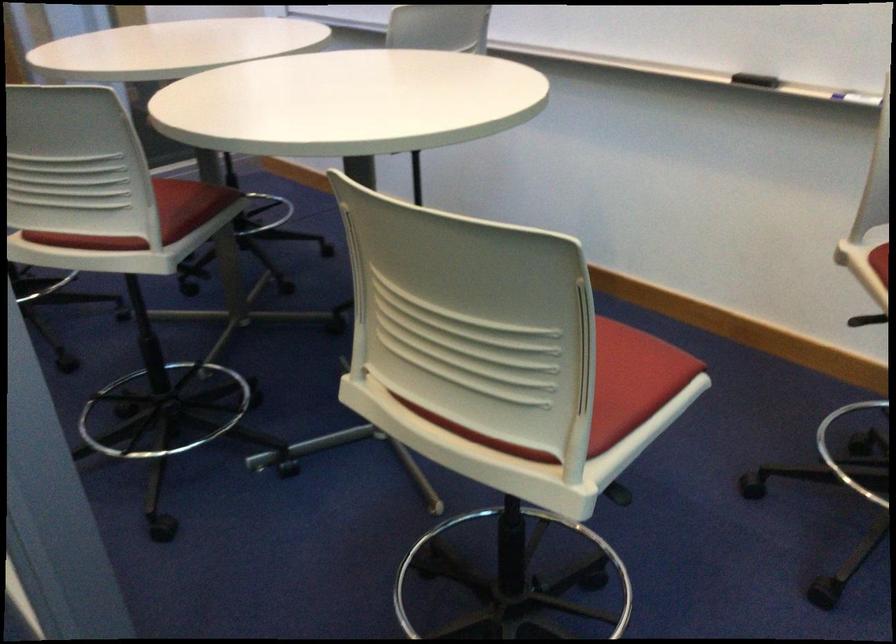
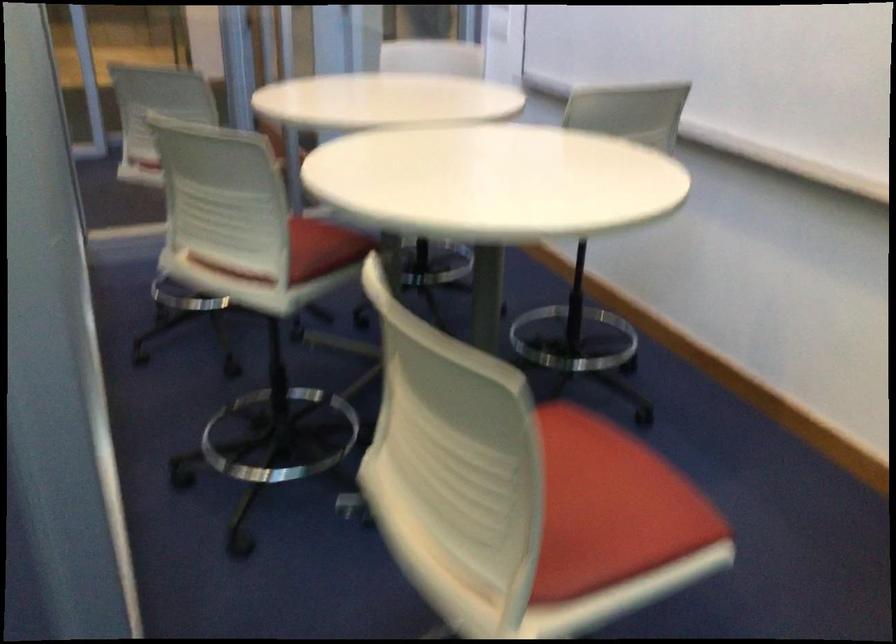
Question: How did the camera likely rotate?

Choices:
 (A) Left
 (B) Right
 (C) Up
 (D) Down

Answer: (A)